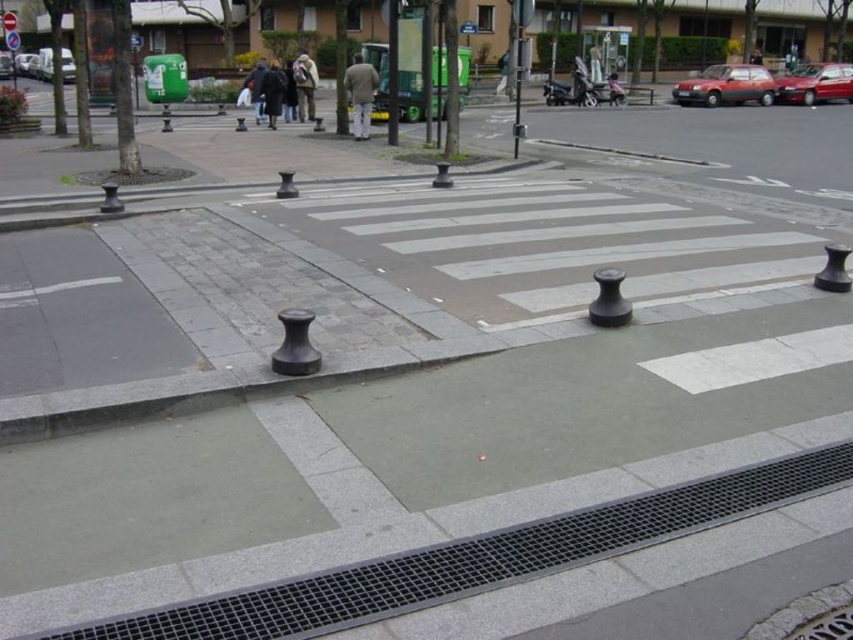
Is metallic red sedan at upper right smaller than light beige fabric jacket at center?

Yes.

Can you confirm if metallic red sedan at upper right is bigger than light beige fabric jacket at center?

Actually, metallic red sedan at upper right might be smaller than light beige fabric jacket at center.

Who is more forward, (798, 100) or (370, 104)?

Point (370, 104) is in front.

Image resolution: width=853 pixels, height=640 pixels. Find the location of `metallic red sedan at upper right`. metallic red sedan at upper right is located at coordinates (815, 83).

Which is below, light brown fabric jacket at center or dark gray jacket at center?

light brown fabric jacket at center is lower down.

Is light brown fabric jacket at center positioned behind dark gray jacket at center?

That is True.

Between point (299, 81) and point (258, 74), which one is positioned in front?

Point (299, 81)

You are a GUI agent. You are given a task and a screenshot of the screen. Output one action in this format:
    pyautogui.click(x=<x>, y=<y>)
    Task: Click on the light brown fabric jacket at center
    Image resolution: width=853 pixels, height=640 pixels.
    Given the screenshot: What is the action you would take?
    coord(305,84)

Does light beige fabric jacket at center appear under dark gray jacket at center?

Yes.

Between point (363, 86) and point (260, 112), which one is positioned behind?

Point (260, 112)

Describe the element at coordinates (360, 93) in the screenshot. This screenshot has width=853, height=640. I see `light beige fabric jacket at center` at that location.

You are a GUI agent. You are given a task and a screenshot of the screen. Output one action in this format:
    pyautogui.click(x=<x>, y=<y>)
    Task: Click on the light beige fabric jacket at center
    This screenshot has height=640, width=853.
    Given the screenshot: What is the action you would take?
    pyautogui.click(x=360, y=93)